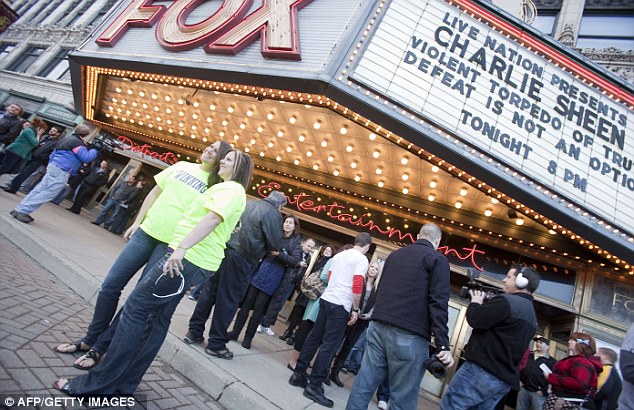
Locate an element on the screen. neon sign is located at coordinates (354, 219), (474, 263), (156, 153), (139, 149).